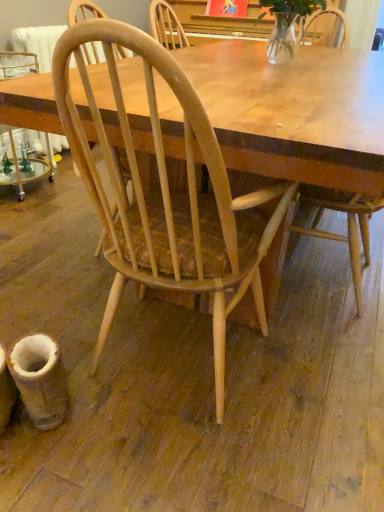
Question: From the image's perspective, is light wood chair at center, the first chair from the right, under natural wood chair at center, acting as the 1th chair starting from the left?

Choices:
 (A) yes
 (B) no

Answer: (B)

Question: From the image's perspective, is light wood chair at center, the first chair from the right, on top of natural wood chair at center, which is the second chair from right to left?

Choices:
 (A) no
 (B) yes

Answer: (B)

Question: Could you tell me if light wood chair at center, the first chair from the right, is turned towards natural wood chair at center, which is the second chair from right to left?

Choices:
 (A) no
 (B) yes

Answer: (A)

Question: Can you confirm if light wood chair at center, the first chair from the right, is wider than natural wood chair at center, which is the second chair from right to left?

Choices:
 (A) no
 (B) yes

Answer: (A)

Question: Does light wood chair at center, marked as the 2th chair in a left-to-right arrangement, touch natural wood chair at center, which is the second chair from right to left?

Choices:
 (A) no
 (B) yes

Answer: (A)

Question: Does light wood chair at center, marked as the 2th chair in a left-to-right arrangement, come behind natural wood chair at center, which is the second chair from right to left?

Choices:
 (A) yes
 (B) no

Answer: (A)

Question: Is clear glass vase at upper center bigger than light wood chair at center, the first chair from the right?

Choices:
 (A) yes
 (B) no

Answer: (B)

Question: Does clear glass vase at upper center have a lesser height compared to light wood chair at center, marked as the 2th chair in a left-to-right arrangement?

Choices:
 (A) no
 (B) yes

Answer: (B)

Question: Is clear glass vase at upper center wider than light wood chair at center, the first chair from the right?

Choices:
 (A) no
 (B) yes

Answer: (A)

Question: From a real-world perspective, is clear glass vase at upper center located higher than light wood chair at center, the first chair from the right?

Choices:
 (A) yes
 (B) no

Answer: (A)

Question: From the image's perspective, does clear glass vase at upper center appear higher than light wood chair at center, the first chair from the right?

Choices:
 (A) yes
 (B) no

Answer: (A)

Question: Is clear glass vase at upper center positioned in front of light wood chair at center, marked as the 2th chair in a left-to-right arrangement?

Choices:
 (A) no
 (B) yes

Answer: (A)

Question: Is natural wood chair at center, acting as the 1th chair starting from the left, not near light wood chair at center, marked as the 2th chair in a left-to-right arrangement?

Choices:
 (A) yes
 (B) no

Answer: (B)